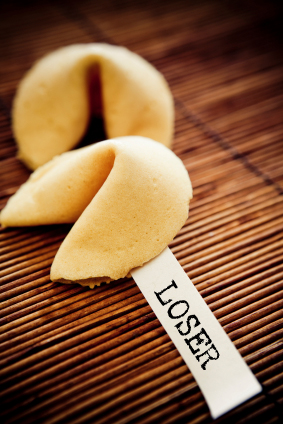
Locate an element on the screen. Image resolution: width=283 pixels, height=424 pixels. straw mat background is located at coordinates tap(229, 224).